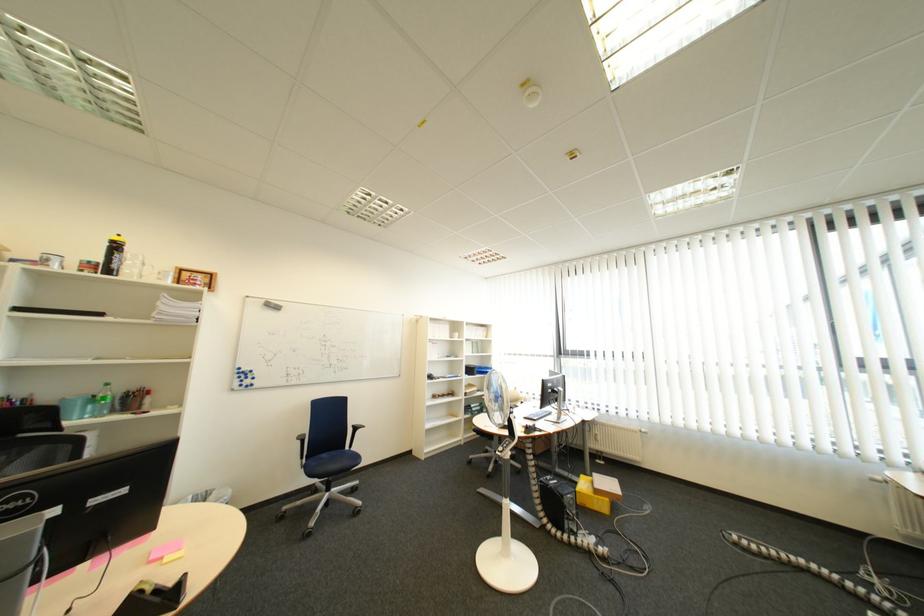
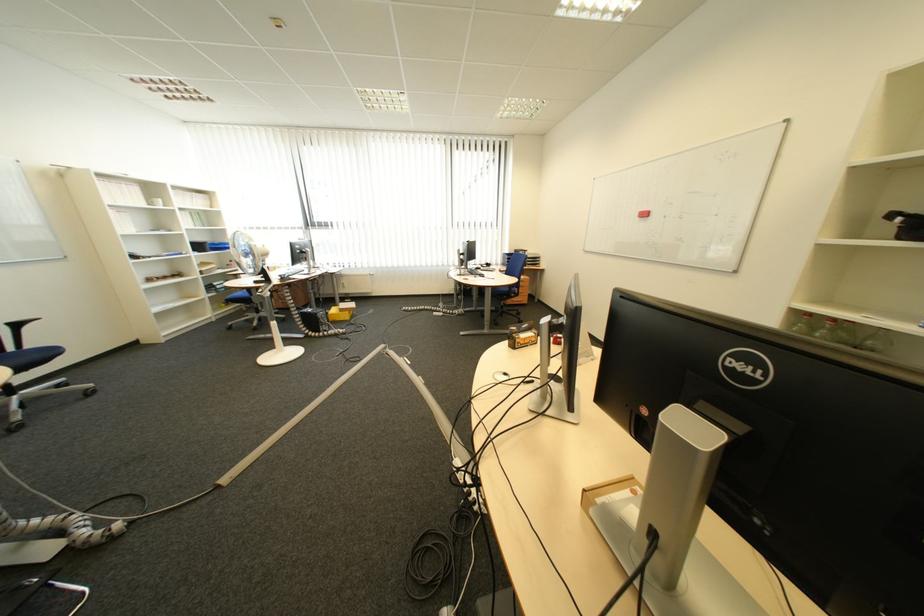
Find the pixel in the second image that matches pixel 329 511 in the first image.

(21, 411)